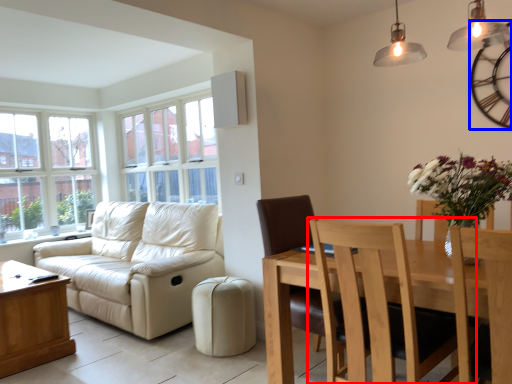
Question: Which object is closer to the camera taking this photo, chair (highlighted by a red box) or clock (highlighted by a blue box)?

Choices:
 (A) chair
 (B) clock

Answer: (A)